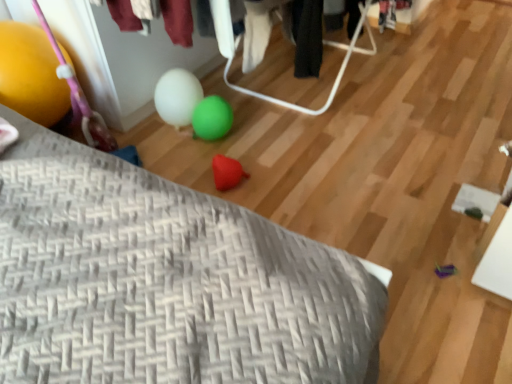
Find the location of `vacant space to the left of rubber heart at center`. vacant space to the left of rubber heart at center is located at coordinates click(x=190, y=172).